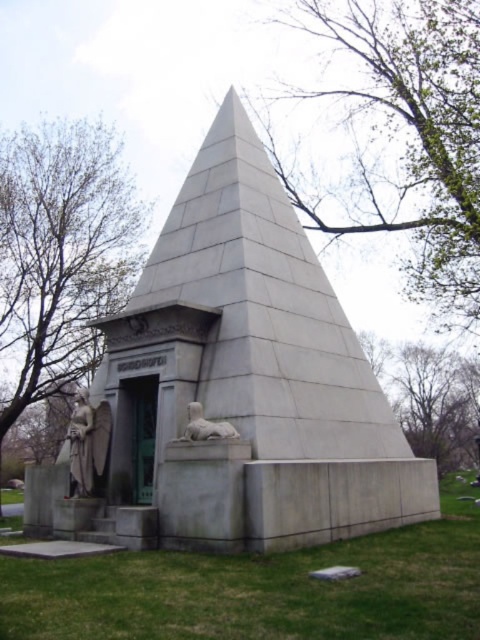
You are standing in front of the mausoleum and want to take a photo of both the gray stone pyramid at center and the green leafy tree at upper center. Which object should you point your camera towards first to ensure both are in the frame?

You should point your camera towards the green leafy tree at upper center first because the gray stone pyramid at center is located below it, ensuring both will be captured in the frame.

You are standing in front of the pyramid mausoleum and want to take a photo of both the green leafy tree at left and the white marble statue at lower left. Which object should you position to your left side in the camera frame to include both in the photo?

You should position the green leafy tree at left to your left side in the camera frame because it is located to the left of the white marble statue at lower left.